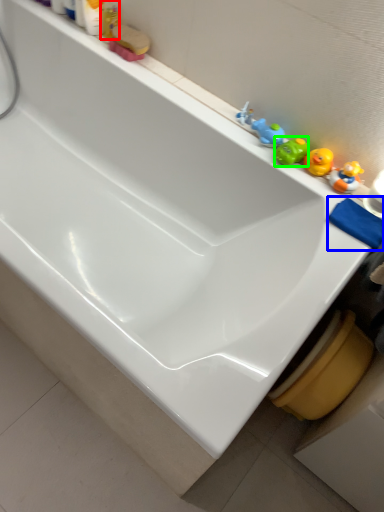
Question: Considering the real-world distances, which object is farthest from toiletry (highlighted by a red box)? bath towel (highlighted by a blue box) or toy (highlighted by a green box)?

Choices:
 (A) bath towel
 (B) toy

Answer: (A)